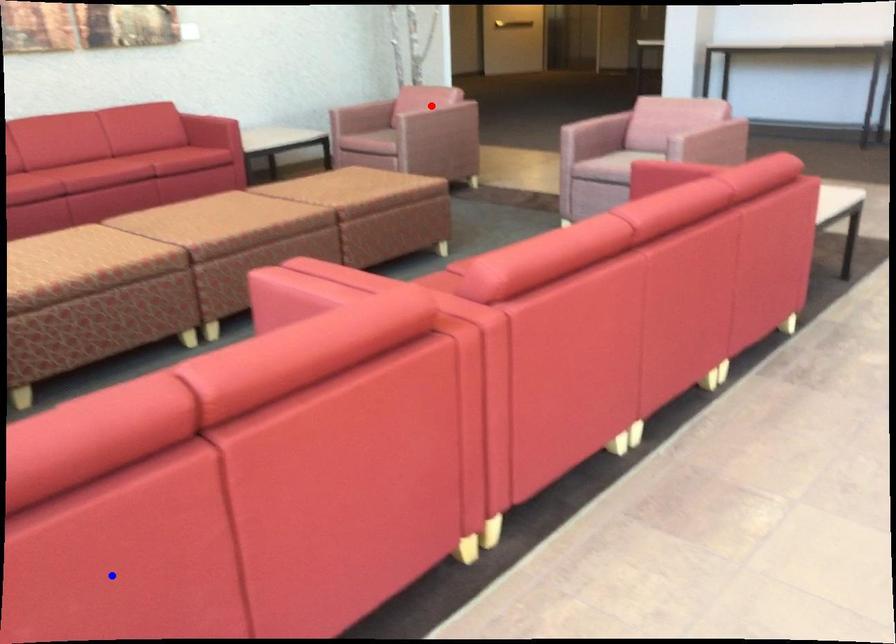
Question: Two points are marked on the image. Which point is closer to the camera?

Choices:
 (A) Blue point is closer.
 (B) Red point is closer.

Answer: (A)